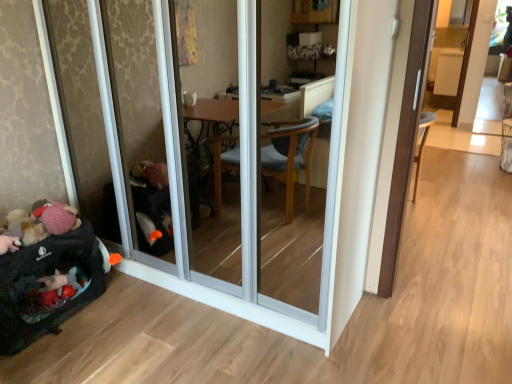
What are the coordinates of `vacant space in front of transparent glass screen door at left` in the screenshot? It's located at (189, 344).